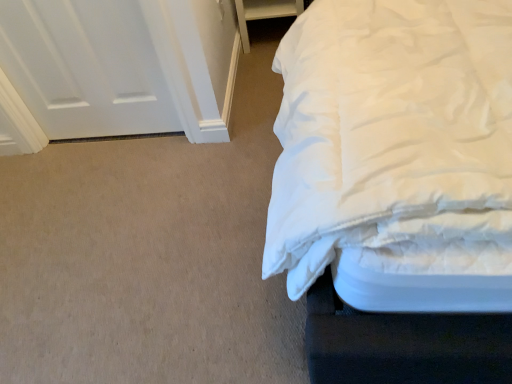
Question: From the image's perspective, is white fabric drawer at upper right located beneath white matte door at upper left?

Choices:
 (A) yes
 (B) no

Answer: (B)

Question: Is the depth of white fabric drawer at upper right greater than that of white matte door at upper left?

Choices:
 (A) no
 (B) yes

Answer: (B)

Question: Considering the relative sizes of white fabric drawer at upper right and white matte door at upper left in the image provided, is white fabric drawer at upper right smaller than white matte door at upper left?

Choices:
 (A) no
 (B) yes

Answer: (A)

Question: Could white matte door at upper left be considered to be inside white fabric drawer at upper right?

Choices:
 (A) no
 (B) yes

Answer: (A)

Question: Is white fabric drawer at upper right not near white matte door at upper left?

Choices:
 (A) no
 (B) yes

Answer: (A)

Question: From the image's perspective, would you say white fabric drawer at upper right is positioned over white matte door at upper left?

Choices:
 (A) no
 (B) yes

Answer: (B)

Question: From a real-world perspective, is white matte door at upper left over white fabric drawer at upper right?

Choices:
 (A) yes
 (B) no

Answer: (A)

Question: Is white matte door at upper left shorter than white fabric drawer at upper right?

Choices:
 (A) yes
 (B) no

Answer: (B)

Question: Is white matte door at upper left positioned behind white fabric drawer at upper right?

Choices:
 (A) no
 (B) yes

Answer: (A)

Question: From the image's perspective, is white matte door at upper left beneath white fabric drawer at upper right?

Choices:
 (A) yes
 (B) no

Answer: (A)

Question: Can we say white matte door at upper left lies outside white fabric drawer at upper right?

Choices:
 (A) yes
 (B) no

Answer: (A)

Question: Considering the relative sizes of white matte door at upper left and white fabric drawer at upper right in the image provided, is white matte door at upper left taller than white fabric drawer at upper right?

Choices:
 (A) no
 (B) yes

Answer: (B)

Question: Looking at their shapes, would you say white fabric drawer at upper right is wider or thinner than white matte door at upper left?

Choices:
 (A) thin
 (B) wide

Answer: (B)